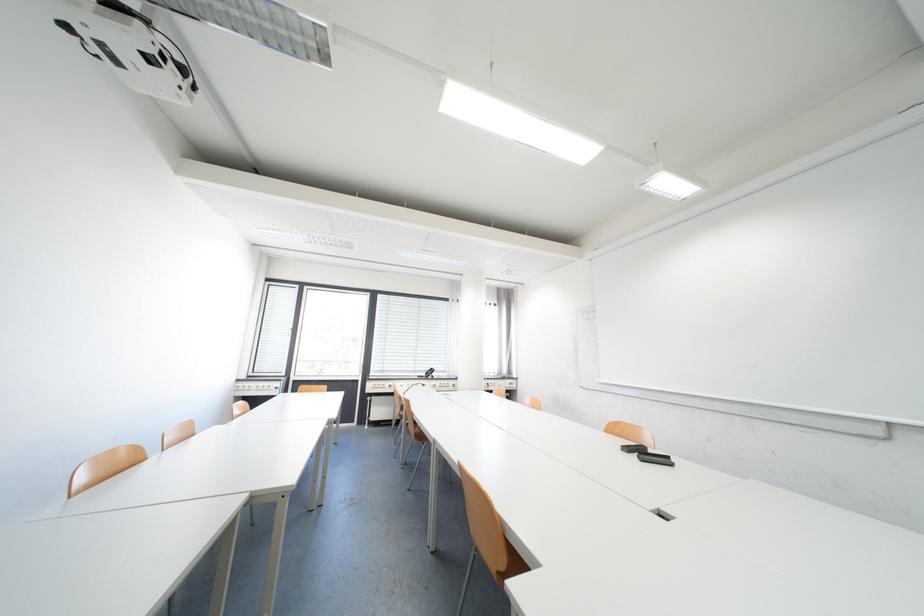
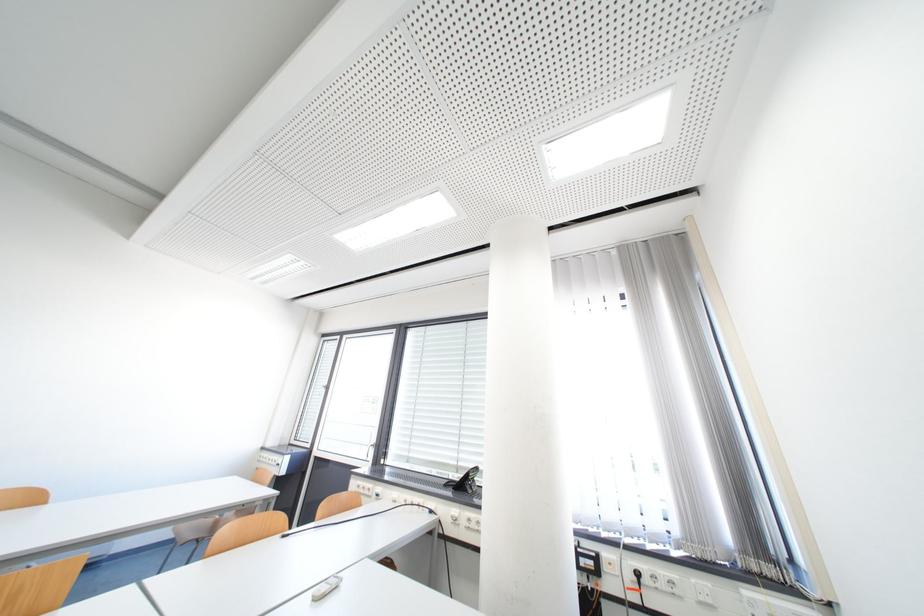
Locate, in the second image, the point that corresponds to [424,371] in the first image.

(468, 469)